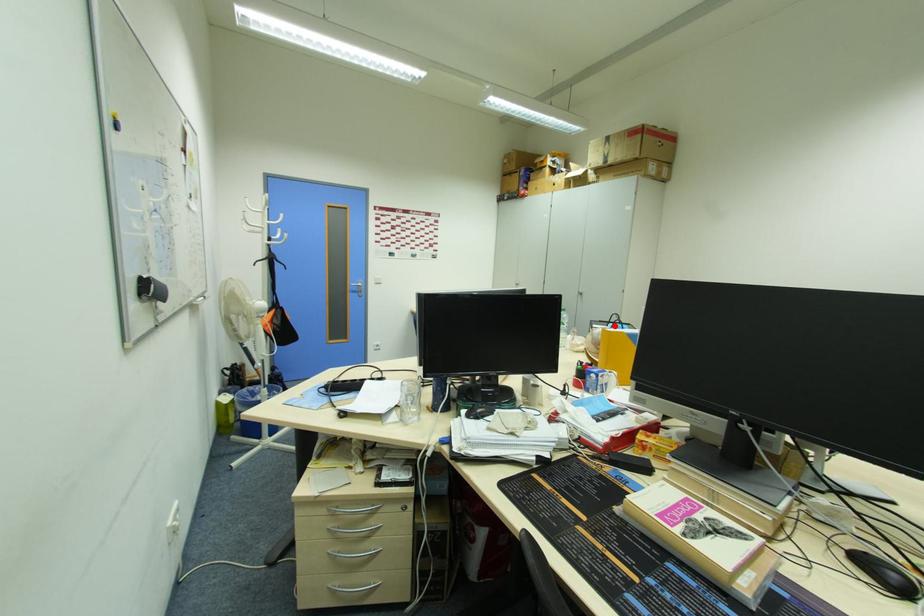
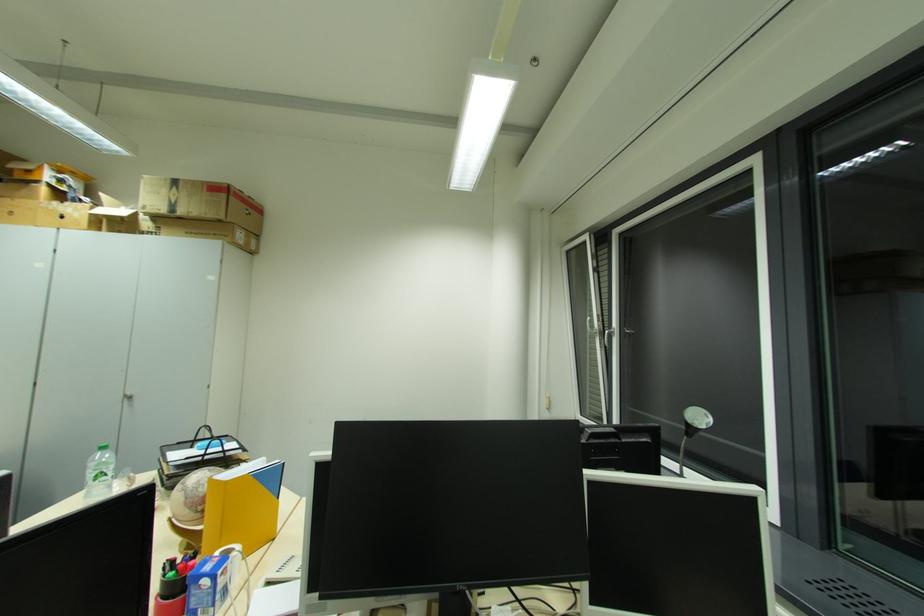
Where in the second image is the point corresponding to the highlighted location from the first image?

(202, 445)